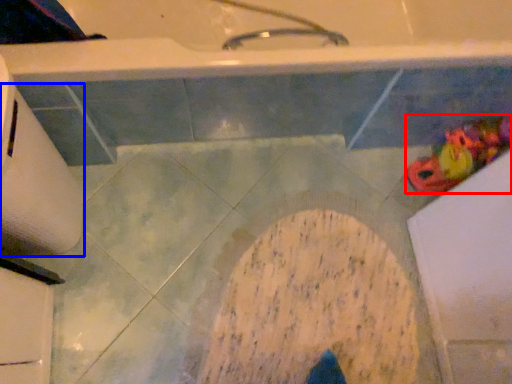
Question: Which point is further to the camera, toy (highlighted by a red box) or toilet paper (highlighted by a blue box)?

Choices:
 (A) toy
 (B) toilet paper

Answer: (A)